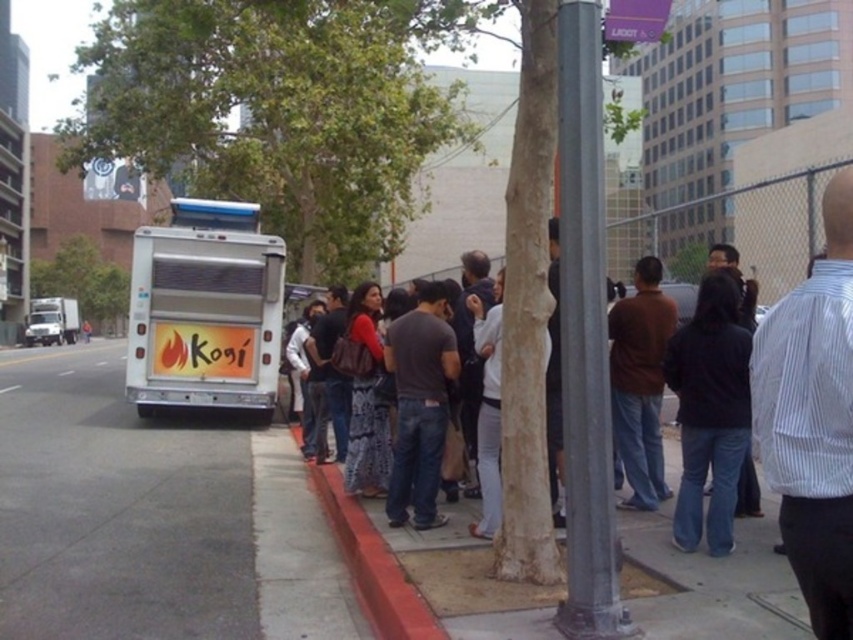
Is point (820, 272) closer to viewer compared to point (364, 464)?

Yes, point (820, 272) is in front of point (364, 464).

Locate an element on the screen. white striped shirt at center is located at coordinates (811, 419).

This screenshot has height=640, width=853. What do you see at coordinates (811, 419) in the screenshot?
I see `white striped shirt at center` at bounding box center [811, 419].

At what (x,y) coordinates should I click in order to perform the action: click on white striped shirt at center. Please return your answer as a coordinate pair (x, y). This screenshot has height=640, width=853. Looking at the image, I should click on (811, 419).

Between point (561, 605) and point (616, 332), which one is positioned in front?

Positioned in front is point (561, 605).

Is gray metallic pole at center to the left of brown matte shirt at center from the viewer's perspective?

Yes, gray metallic pole at center is to the left of brown matte shirt at center.

Between point (595, 1) and point (634, 465), which one is positioned in front?

Positioned in front is point (595, 1).

The width and height of the screenshot is (853, 640). What are the coordinates of `gray metallic pole at center` in the screenshot? It's located at (585, 337).

Find the location of a particular element. This screenshot has width=853, height=640. gray metallic pole at center is located at coordinates (585, 337).